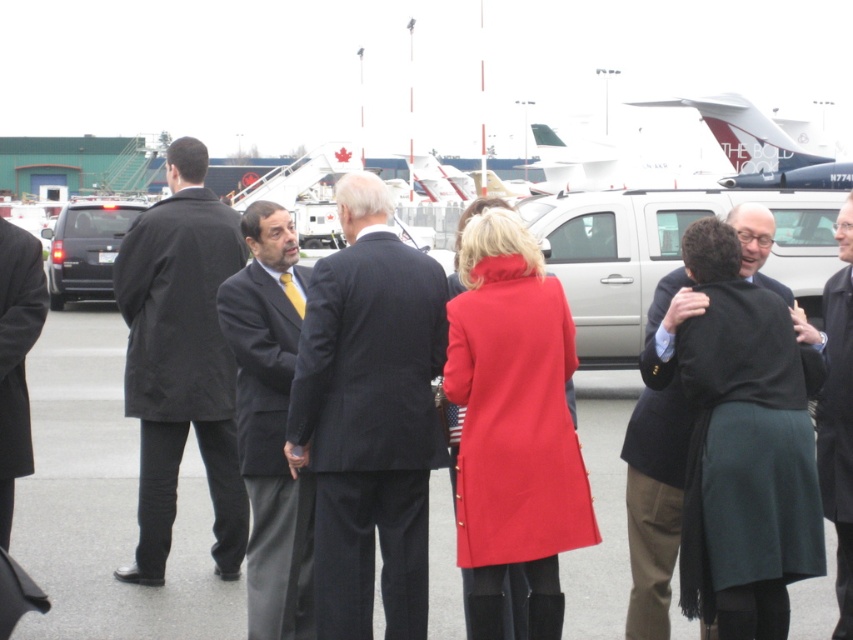
Question: Can you confirm if smooth asphalt tarmac at center is smaller than white matte airplane at upper center?

Choices:
 (A) yes
 (B) no

Answer: (A)

Question: Can you confirm if white glossy airplane at upper center is wider than matte black suv at left?

Choices:
 (A) no
 (B) yes

Answer: (B)

Question: Which point is closer to the camera?

Choices:
 (A) (793, 150)
 (B) (247, 522)
 (C) (828, 371)

Answer: (C)

Question: Which object is the closest to the white matte airplane at upper center?

Choices:
 (A) matte black suit at center
 (B) white glossy airplane at upper center

Answer: (B)

Question: Among these objects, which one is farthest from the camera?

Choices:
 (A) white glossy airplane at center
 (B) silver metallic suv at right
 (C) dark suit at center
 (D) black coat at center

Answer: (A)

Question: Does matte black suit at center appear under white glossy airplane at center?

Choices:
 (A) no
 (B) yes

Answer: (B)